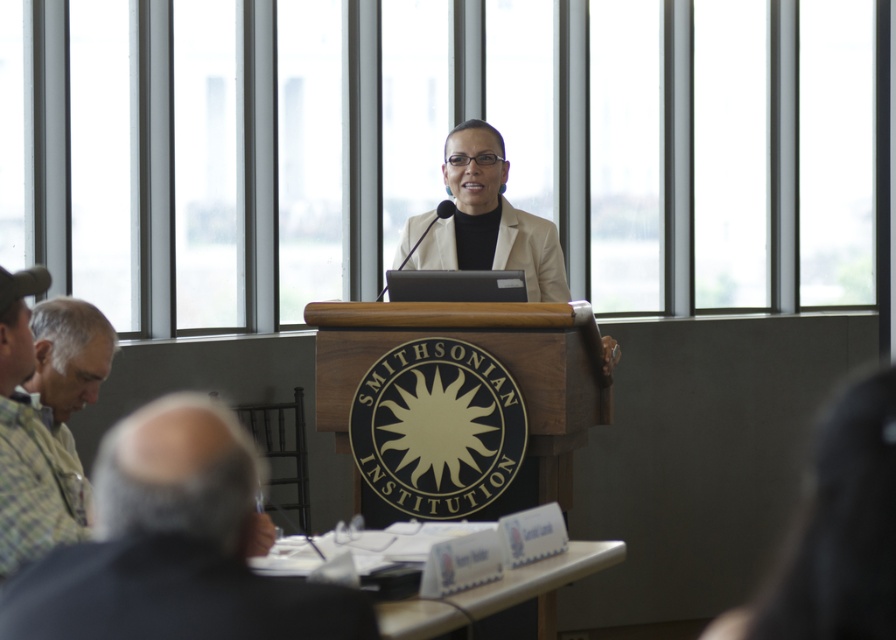
What do you see at coordinates (836, 531) in the screenshot? This screenshot has height=640, width=896. I see `smooth black hair at center` at bounding box center [836, 531].

How distant is smooth black hair at center from green plaid shirt at lower left?

smooth black hair at center and green plaid shirt at lower left are 5.37 meters apart.

The image size is (896, 640). In order to click on smooth black hair at center in this screenshot , I will do `click(836, 531)`.

Measure the distance between gray fabric shirt at lower left and camera.

They are 2.24 meters apart.

Can you confirm if gray fabric shirt at lower left is wider than green plaid shirt at lower left?

Yes.

Is point (237, 611) positioned after point (110, 339)?

No.

Locate an element on the screen. The image size is (896, 640). gray fabric shirt at lower left is located at coordinates (174, 545).

Where is `gray fabric shirt at lower left`? This screenshot has height=640, width=896. gray fabric shirt at lower left is located at coordinates (174, 545).

The height and width of the screenshot is (640, 896). I want to click on gray fabric shirt at lower left, so click(x=174, y=545).